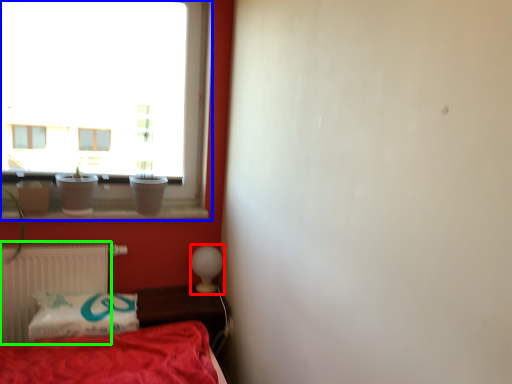
Question: Which object is positioned farthest from table lamp (highlighted by a red box)? Select from window (highlighted by a blue box) and radiator (highlighted by a green box).

Choices:
 (A) window
 (B) radiator

Answer: (A)